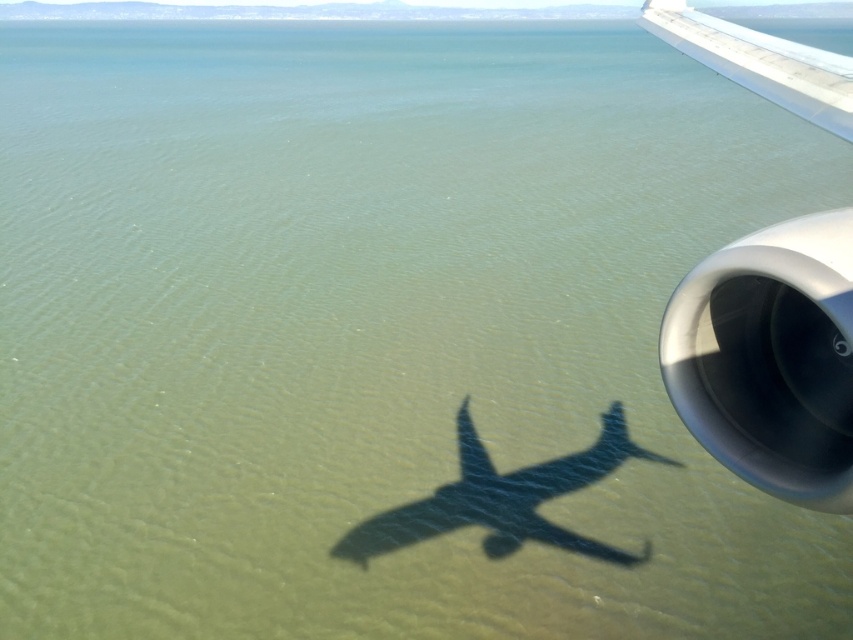
Can you confirm if silver metallic engine at right is shorter than white metallic wing at upper right?

Indeed, silver metallic engine at right has a lesser height compared to white metallic wing at upper right.

Does point (753, 403) lie in front of point (672, 33)?

Yes, point (753, 403) is closer to viewer.

The image size is (853, 640). Identify the location of silver metallic engine at right. (761, 358).